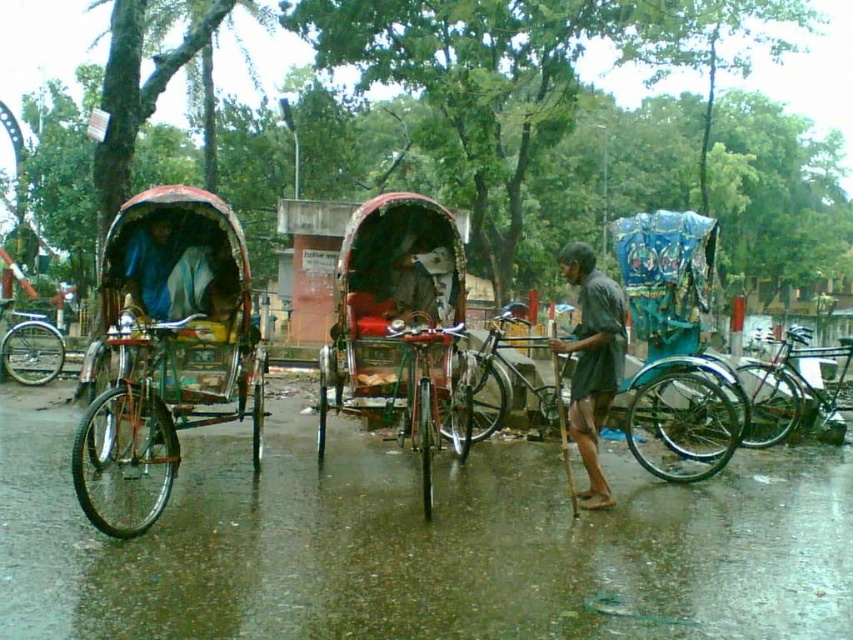
You are a tourist standing on the wet road and want to take a photo of the metallic red rickshaw at left and the red fabric rickshaw at center. Which rickshaw should you focus on first to ensure both are in the frame?

You should focus on the metallic red rickshaw at left first because it is closer to you than the red fabric rickshaw at center, so it will be in the foreground and ensure both are visible in the frame.

You are a delivery person needing to carry a 10kg package through the area. The path between the dark gray fabric shirt at center and the shiny metallic bicycle at center is narrow. Can you pass through with your package?

The dark gray fabric shirt at center is thinner than the shiny metallic bicycle at center, so the path between them is narrow. Since the package is 10kg, the weight isn not an issue, but the narrow path may be challenging. However, since the shirt is thinner, it can move aside if needed, allowing you to pass through.